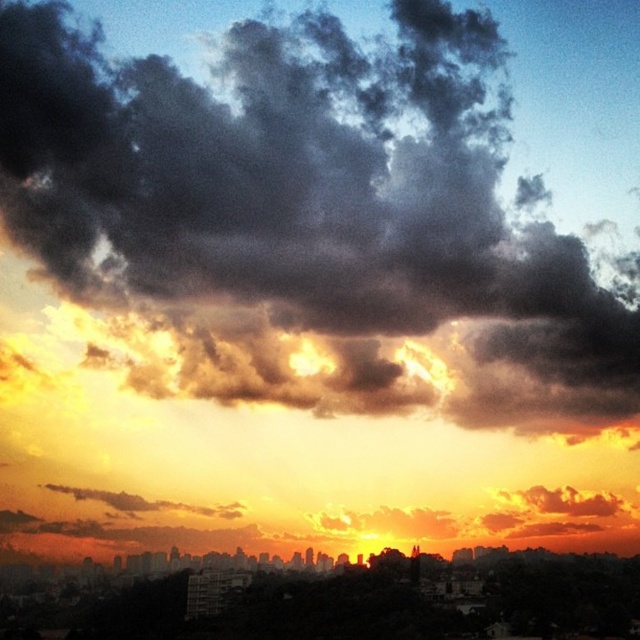
I want to click on dark gray fluffy cloud at upper center, so click(307, 221).

Can you confirm if dark gray fluffy cloud at upper center is positioned to the left of silhouetted cityscape at center?

Indeed, dark gray fluffy cloud at upper center is positioned on the left side of silhouetted cityscape at center.

Between point (493, 29) and point (486, 625), which one is positioned in front?

Point (493, 29) is more forward.

The image size is (640, 640). Find the location of `dark gray fluffy cloud at upper center`. dark gray fluffy cloud at upper center is located at coordinates 307,221.